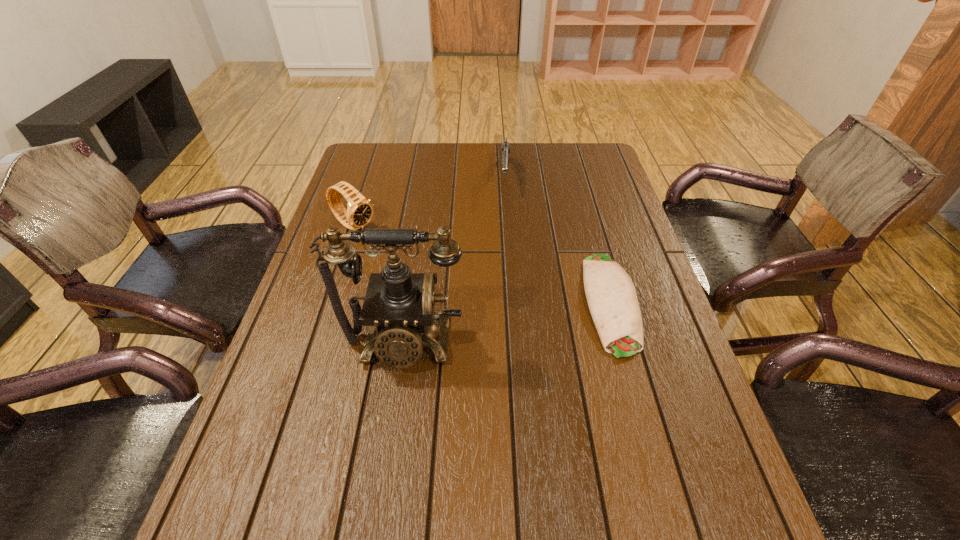
Locate an element on the screen. free space between the watch and the shortest object is located at coordinates (482, 264).

The image size is (960, 540). I want to click on object that is the nearest to the second farthest object, so click(x=398, y=306).

Identify the location of object that is the third closest to the telephone. (505, 151).

The height and width of the screenshot is (540, 960). Identify the location of vacant space that satisfies the following two spatial constraints: 1. on the back side of the gun; 2. on the left side of the third shortest object. (370, 176).